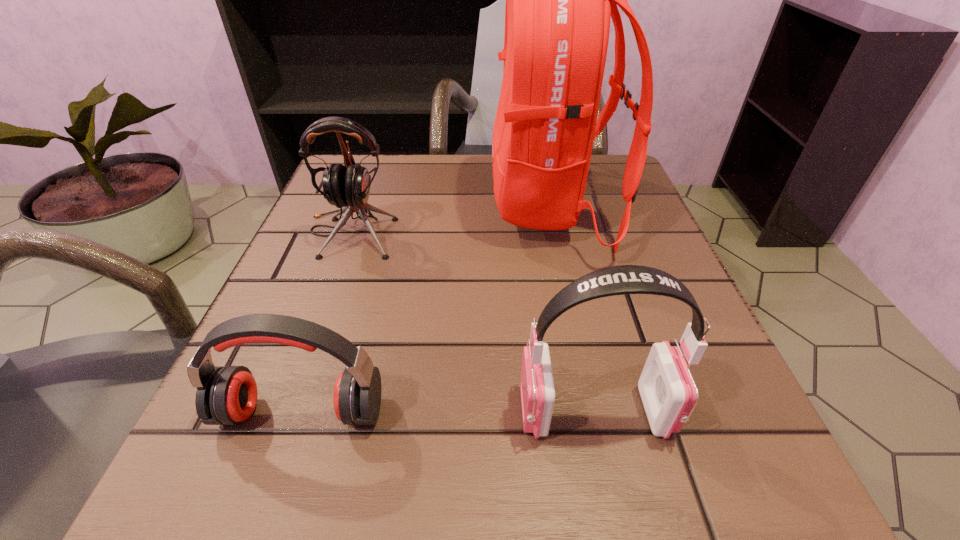
What are the coordinates of `free spot located 0.340m on the outer surface of the rightmost earphone` in the screenshot? It's located at (252, 411).

This screenshot has width=960, height=540. I want to click on backpack located in the far edge section of the desktop, so click(x=559, y=0).

The width and height of the screenshot is (960, 540). Identify the location of earphone present at the far edge. (348, 186).

The height and width of the screenshot is (540, 960). In order to click on object located in the near edge section of the desktop in this screenshot , I will do tap(669, 394).

Identify the location of backpack at the right edge. The width and height of the screenshot is (960, 540). (559, 0).

Locate an element on the screen. This screenshot has height=540, width=960. earphone located at the right edge is located at coordinates (669, 394).

The height and width of the screenshot is (540, 960). Find the location of `object at the far left corner`. object at the far left corner is located at coordinates (348, 186).

Image resolution: width=960 pixels, height=540 pixels. Identify the location of object that is at the far right corner. (559, 0).

Identify the location of object located in the near right corner section of the desktop. (669, 394).

The height and width of the screenshot is (540, 960). In the image, there is a desktop. What are the coordinates of `blank space at the far edge` in the screenshot? It's located at (x=475, y=173).